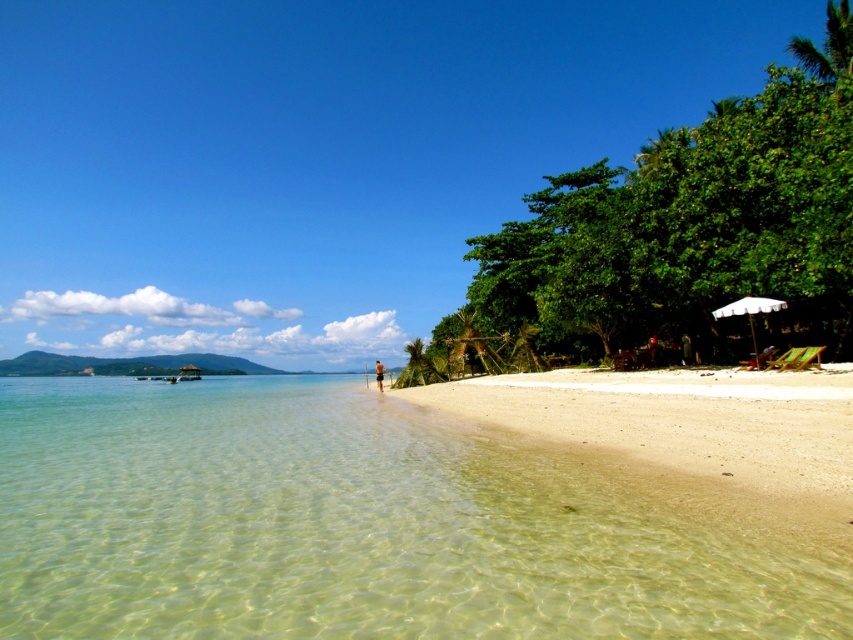
You are standing on the beach and want to reach the white striped umbrella at right. The distance you can walk is limited to 20 meters. Can you reach it?

The white striped umbrella at right is 21.35 meters away from the viewer, so you cannot reach it within the 20 meter limit.

You are a photographer trying to capture the beach scene. You want to ensure that both the clear water at lower left and the white striped umbrella at right are visible in your shot. Which object will appear taller in the photo?

The clear water at lower left appears taller than the white striped umbrella at right in the photo because the clear water at lower left has a greater height compared to the white striped umbrella at right.

You are standing on the beach and want to wade into the clear water at lower left while keeping your brown textured shorts at center dry. Is the water level low enough to do so?

The clear water at lower left is not as tall as brown textured shorts at center, so yes, the water level is low enough to wade in while keeping the shorts dry.